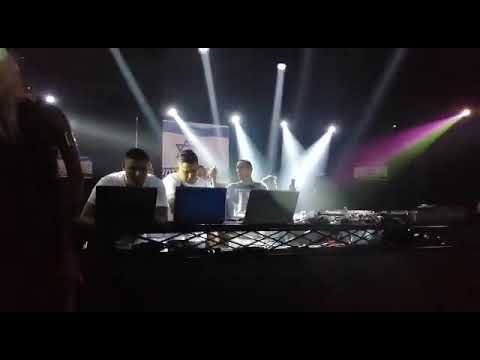
Locate an element on the screen. Image resolution: width=480 pixels, height=360 pixels. dark blue laptop lid is located at coordinates (192, 207).